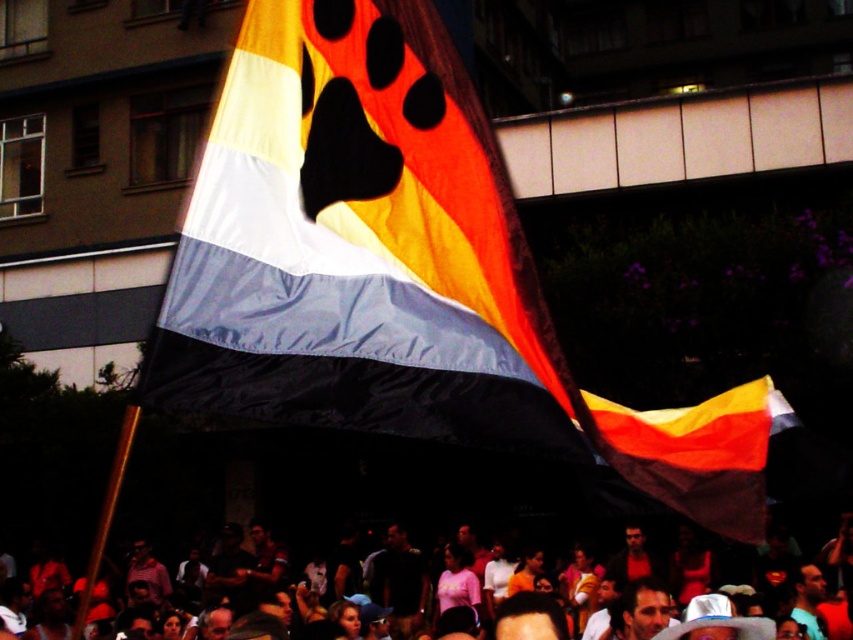
You are an event planner assessing the visual impact of the scene. Considering the silky fabric flag at center and the matte orange crowd at lower center, which object takes up more area in the image?

The matte orange crowd at lower center occupies more space than the silky fabric flag at center, so the crowd takes up more area in the image.

You are standing at the front of the event and see the silky fabric flag at center and the matte orange crowd at lower center. Which object is nearer to you?

The silky fabric flag at center is closer to the viewer than the matte orange crowd at lower center.

You are standing at the event and see two points in the image, one at point (277, 172) and another at point (844, 609). Which point is closer to you?

Point (277, 172) is closer to the camera than point (844, 609), so the point at (277, 172) is closer to you.